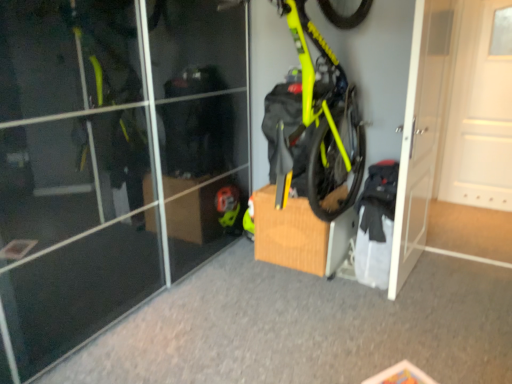
Question: Is white matte door at right, which appears as the first door when viewed from the right, wider or thinner than brown cardboard box at center?

Choices:
 (A) thin
 (B) wide

Answer: (A)

Question: From a real-world perspective, is white matte door at right, which appears as the first door when viewed from the right, physically located above or below brown cardboard box at center?

Choices:
 (A) above
 (B) below

Answer: (A)

Question: Which object is the closest to the brown cardboard box at center?

Choices:
 (A) white matte door at right, which ranks as the 2th door in left-to-right order
 (B) neon yellow matte bicycle at center
 (C) white glossy door at center right, marked as the second door in a right-to-left arrangement

Answer: (B)

Question: Estimate the real-world distances between objects in this image. Which object is farther from the brown cardboard box at center?

Choices:
 (A) white glossy door at center right, marked as the second door in a right-to-left arrangement
 (B) white matte door at right, which ranks as the 2th door in left-to-right order
 (C) neon yellow matte bicycle at center

Answer: (B)